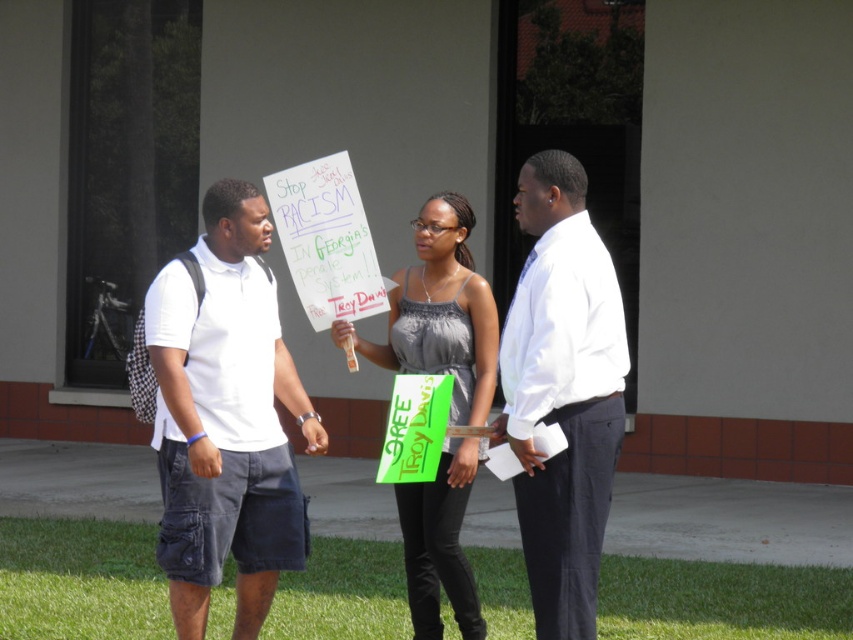
Question: Considering the real-world distances, which object is closest to the white paper sign at center?

Choices:
 (A) green grass at lower center
 (B) white smooth shirt at center
 (C) white cotton polo shirt at left

Answer: (B)

Question: Which point is farther to the camera?

Choices:
 (A) [575, 224]
 (B) [379, 550]
 (C) [253, 342]

Answer: (B)

Question: Is white cotton polo shirt at left closer to the viewer compared to matte gray tank top at center?

Choices:
 (A) no
 (B) yes

Answer: (B)

Question: Which point appears farthest from the camera in this image?

Choices:
 (A) (531, 584)
 (B) (492, 557)
 (C) (457, 449)
 (D) (260, 460)

Answer: (B)

Question: Is white paper sign at center further to camera compared to green grass at lower center?

Choices:
 (A) yes
 (B) no

Answer: (B)

Question: Is white paper sign at center smaller than white cotton polo shirt at left?

Choices:
 (A) yes
 (B) no

Answer: (B)